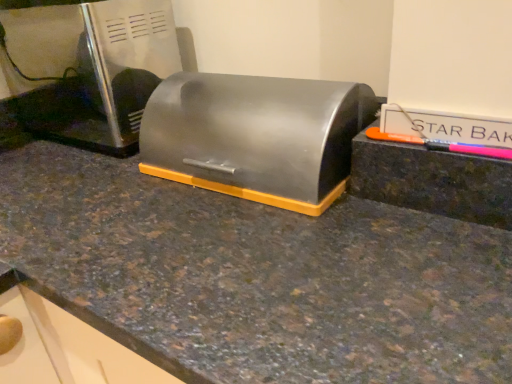
Where is `satin silver toaster at upper left`? satin silver toaster at upper left is located at coordinates (86, 67).

The height and width of the screenshot is (384, 512). Describe the element at coordinates (86, 67) in the screenshot. I see `satin silver toaster at upper left` at that location.

This screenshot has height=384, width=512. Identify the location of satin silver breadbox at center. (256, 136).

Describe the element at coordinates (256, 136) in the screenshot. I see `satin silver breadbox at center` at that location.

Where is `satin silver toaster at upper left`? The height and width of the screenshot is (384, 512). satin silver toaster at upper left is located at coordinates (86, 67).

Considering the positions of objects satin silver toaster at upper left and satin silver breadbox at center in the image provided, who is more to the right, satin silver toaster at upper left or satin silver breadbox at center?

satin silver breadbox at center.

Which object is closer to the camera taking this photo, satin silver toaster at upper left or satin silver breadbox at center?

satin silver breadbox at center is more forward.

Which point is more distant from viewer, (38, 14) or (234, 164)?

Positioned behind is point (38, 14).

From the image's perspective, which object appears higher, satin silver toaster at upper left or satin silver breadbox at center?

satin silver toaster at upper left is shown above in the image.

From a real-world perspective, is satin silver toaster at upper left on top of satin silver breadbox at center?

Yes, from a real-world perspective, satin silver toaster at upper left is above satin silver breadbox at center.

Which object is thinner, satin silver toaster at upper left or satin silver breadbox at center?

satin silver breadbox at center is thinner.

Considering the sizes of objects satin silver toaster at upper left and satin silver breadbox at center in the image provided, who is shorter, satin silver toaster at upper left or satin silver breadbox at center?

satin silver breadbox at center is shorter.

Can you confirm if satin silver toaster at upper left is bigger than satin silver breadbox at center?

Indeed, satin silver toaster at upper left has a larger size compared to satin silver breadbox at center.

From the picture: Which is correct: satin silver toaster at upper left is inside satin silver breadbox at center, or outside of it?

satin silver toaster at upper left is not enclosed by satin silver breadbox at center.

Are satin silver toaster at upper left and satin silver breadbox at center far apart?

satin silver toaster at upper left is near satin silver breadbox at center, not far away.

Is satin silver toaster at upper left facing towards satin silver breadbox at center?

No, satin silver toaster at upper left is not oriented towards satin silver breadbox at center.

Measure the distance between satin silver toaster at upper left and satin silver breadbox at center.

A distance of 11.87 inches exists between satin silver toaster at upper left and satin silver breadbox at center.

Identify the location of home appliance above the satin silver breadbox at center (from a real-world perspective). (86, 67).

Which is more to the right, satin silver breadbox at center or satin silver toaster at upper left?

satin silver breadbox at center.

Is satin silver breadbox at center in front of or behind satin silver toaster at upper left in the image?

In the image, satin silver breadbox at center appears in front of satin silver toaster at upper left.

Which is more distant, (264,177) or (134,40)?

Positioned behind is point (134,40).

From the image's perspective, is satin silver breadbox at center below satin silver toaster at upper left?

Yes, from the image's perspective, satin silver breadbox at center is beneath satin silver toaster at upper left.

From a real-world perspective, who is located lower, satin silver breadbox at center or satin silver toaster at upper left?

From a 3D spatial view, satin silver breadbox at center is below.

Which object is thinner, satin silver breadbox at center or satin silver toaster at upper left?

Thinner between the two is satin silver breadbox at center.

Who is shorter, satin silver breadbox at center or satin silver toaster at upper left?

satin silver breadbox at center is shorter.

Looking at the image, does satin silver breadbox at center seem bigger or smaller compared to satin silver toaster at upper left?

satin silver breadbox at center is smaller than satin silver toaster at upper left.

Is satin silver toaster at upper left inside satin silver breadbox at center?

No, satin silver toaster at upper left is not a part of satin silver breadbox at center.

Is satin silver breadbox at center beside satin silver toaster at upper left?

satin silver breadbox at center and satin silver toaster at upper left are not in contact.

Consider the image. Is satin silver breadbox at center oriented away from satin silver toaster at upper left?

No, satin silver breadbox at center's orientation is not away from satin silver toaster at upper left.

How far apart are satin silver breadbox at center and satin silver toaster at upper left?

satin silver breadbox at center and satin silver toaster at upper left are 11.87 inches apart.

Identify the location of home appliance behind the satin silver breadbox at center. (86, 67).

Where is `home appliance on the left of satin silver breadbox at center`? home appliance on the left of satin silver breadbox at center is located at coordinates (86, 67).

In the image, there is a satin silver toaster at upper left. Find the location of `appliance below it (from the image's perspective)`. appliance below it (from the image's perspective) is located at coordinates (256, 136).